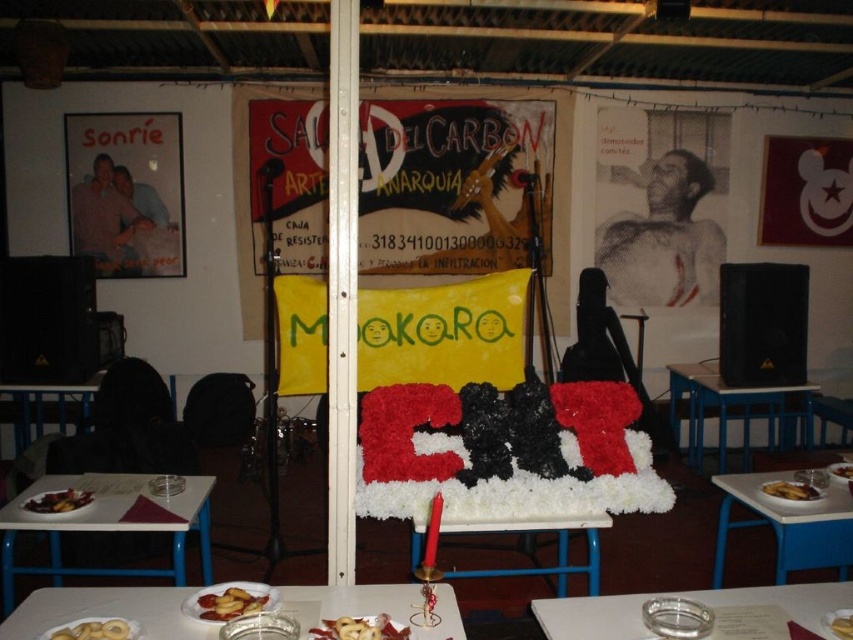
You are at a community event and want to take a photo of the slightly browned bread at lower center and the yellow matte plate at center. Which object should you focus on first if you want to capture both in one shot without moving the camera?

The slightly browned bread at lower center is taller than the yellow matte plate at center, so you should focus on the slightly browned bread at lower center first to ensure both are in frame.

You are setting up a buffet table for an event and need to arrange the white glossy plate at lower center and the yellow matte plate at center. According to the image, where should you place each plate relative to the other?

The white glossy plate at lower center should be placed below the yellow matte plate at center as per the image.

You are setting up a table for a community event and need to place two plates on it. You have a translucent glass plate at lower center and a white glossy plate at lower center. According to the image, which plate should you place on top to match the setup?

The translucent glass plate at lower center should be placed on top of the white glossy plate at lower center because it is located above it in the image.